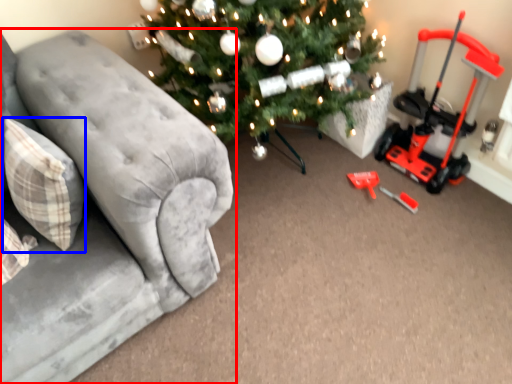
Question: Which of the following is the farthest to the observer, studio couch (highlighted by a red box) or pillow (highlighted by a blue box)?

Choices:
 (A) studio couch
 (B) pillow

Answer: (B)